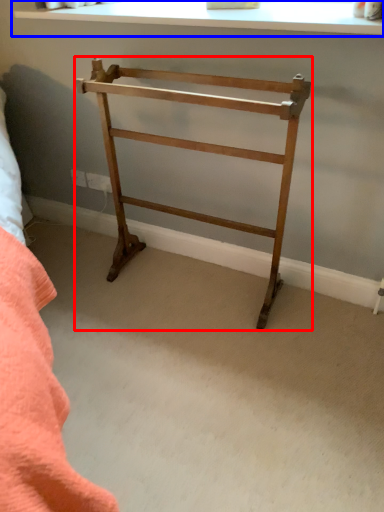
Question: Which point is further to the camera, furniture (highlighted by a red box) or window (highlighted by a blue box)?

Choices:
 (A) furniture
 (B) window

Answer: (B)